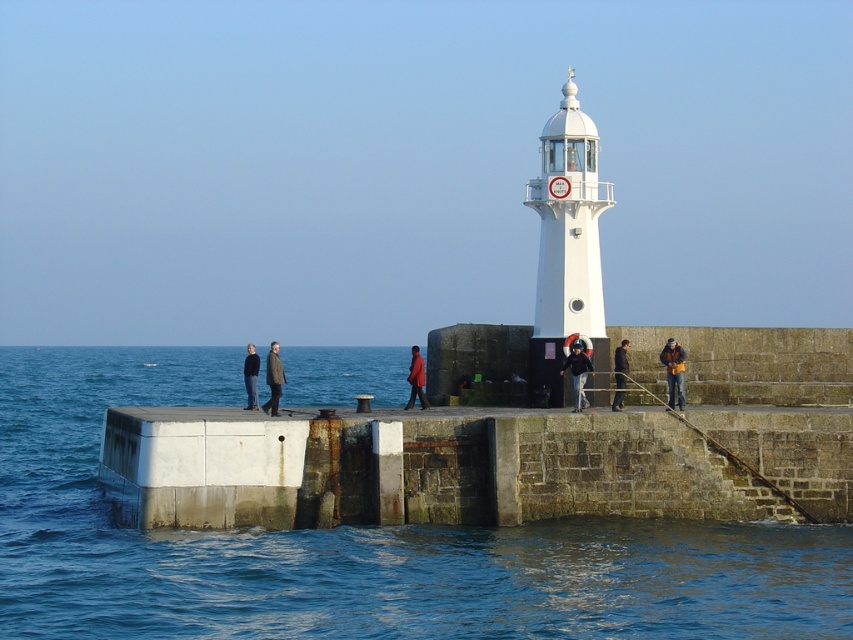
Question: In this image, where is white glossy lighthouse at center located relative to brown leather jacket at center?

Choices:
 (A) below
 (B) above

Answer: (B)

Question: Which point is closer to the camera?

Choices:
 (A) clear blue water at lower left
 (B) dark blue jacket at center

Answer: (A)

Question: Among these objects, which one is farthest from the camera?

Choices:
 (A) dark blue jacket at left
 (B) dark blue jacket at center

Answer: (A)

Question: Is matte red coat at center smaller than dark blue jacket at left?

Choices:
 (A) no
 (B) yes

Answer: (B)

Question: Can you confirm if rusty concrete dock at lower center is positioned above white glossy lighthouse at center?

Choices:
 (A) yes
 (B) no

Answer: (B)

Question: Which of these objects is positioned closest to the dark brown leather jacket at center?

Choices:
 (A) dark blue jacket at left
 (B) white glossy lighthouse at center

Answer: (B)